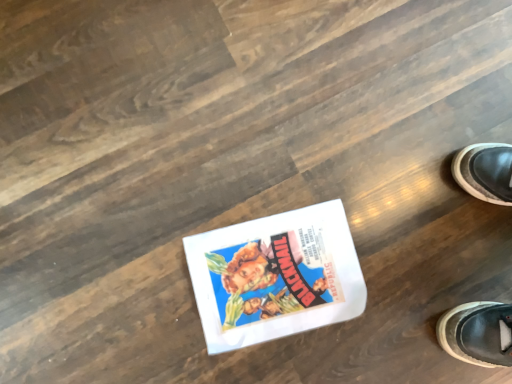
Find the location of a particular element. vacant area that is in front of matte paper book at center is located at coordinates (204, 360).